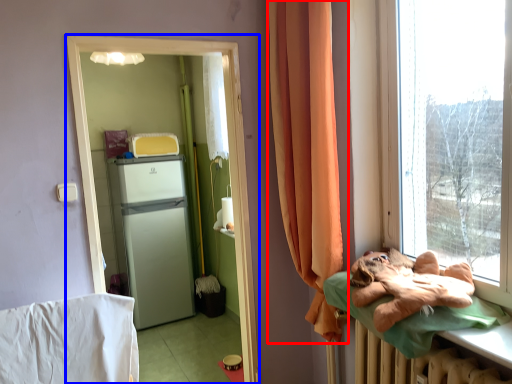
Question: Which object is closer to the camera taking this photo, curtain (highlighted by a red box) or screen door (highlighted by a blue box)?

Choices:
 (A) curtain
 (B) screen door

Answer: (A)